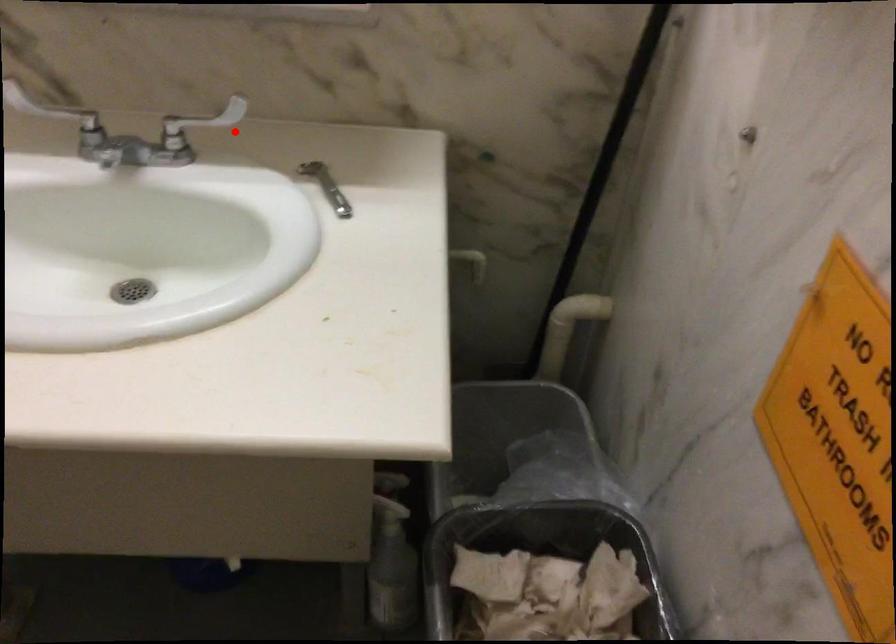
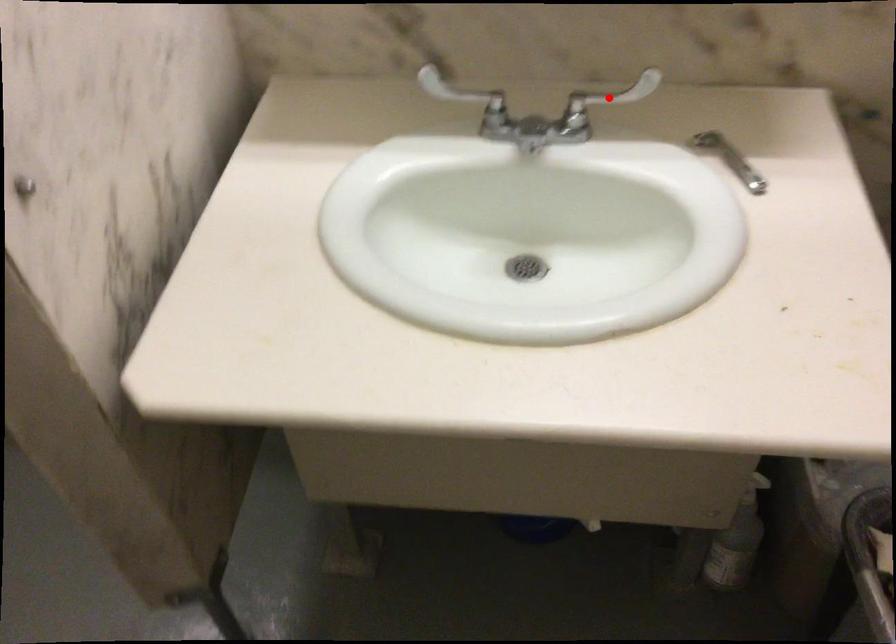
I am providing you with two images of the same scene from different viewpoints. A red point is marked on the first image and another point is marked on the second image. Is the marked point in image1 the same physical position as the marked point in image2?

Yes